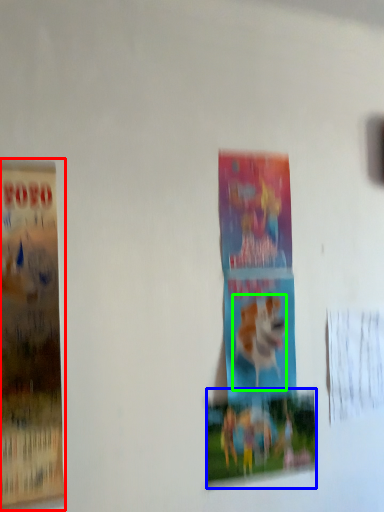
Question: Which object is positioned farthest from poster (highlighted by a red box)? Select from poster (highlighted by a blue box) and animal (highlighted by a green box).

Choices:
 (A) poster
 (B) animal

Answer: (B)